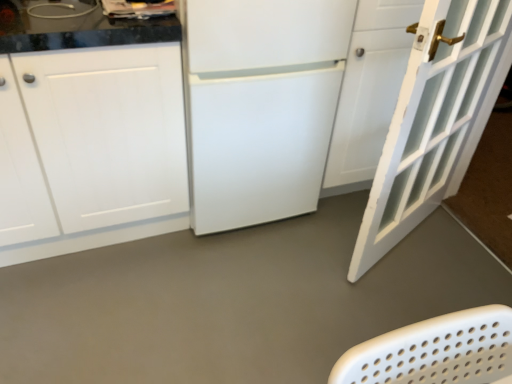
Question: Can you confirm if white matte cabinet at left is taller than white painted wood door at right?

Choices:
 (A) no
 (B) yes

Answer: (A)

Question: Is white matte cabinet at left directly adjacent to white painted wood door at right?

Choices:
 (A) yes
 (B) no

Answer: (B)

Question: Considering the relative sizes of white matte cabinet at left and white painted wood door at right in the image provided, is white matte cabinet at left bigger than white painted wood door at right?

Choices:
 (A) no
 (B) yes

Answer: (B)

Question: From a real-world perspective, is white matte cabinet at left located higher than white painted wood door at right?

Choices:
 (A) yes
 (B) no

Answer: (B)

Question: Is white matte cabinet at left oriented away from white painted wood door at right?

Choices:
 (A) yes
 (B) no

Answer: (B)

Question: Is white painted wood door at right bigger or smaller than white matte refrigerator at center?

Choices:
 (A) big
 (B) small

Answer: (B)

Question: Does point tap(457, 117) appear closer or farther from the camera than point tap(204, 168)?

Choices:
 (A) farther
 (B) closer

Answer: (A)

Question: Is white painted wood door at right inside the boundaries of white matte refrigerator at center, or outside?

Choices:
 (A) outside
 (B) inside

Answer: (A)

Question: In the image, is white painted wood door at right positioned in front of or behind white matte refrigerator at center?

Choices:
 (A) behind
 (B) front

Answer: (B)

Question: Is point (415, 319) positioned closer to the camera than point (439, 13)?

Choices:
 (A) farther
 (B) closer

Answer: (A)

Question: Is gray matte floor at center in front of or behind white painted wood door at right in the image?

Choices:
 (A) behind
 (B) front

Answer: (A)

Question: From the image's perspective, is gray matte floor at center above or below white painted wood door at right?

Choices:
 (A) above
 (B) below

Answer: (B)

Question: Is gray matte floor at center to the left or to the right of white painted wood door at right in the image?

Choices:
 (A) left
 (B) right

Answer: (A)

Question: Is white painted wood door at right spatially inside white matte cabinet at left, or outside of it?

Choices:
 (A) inside
 (B) outside

Answer: (B)

Question: In terms of size, does white painted wood door at right appear bigger or smaller than white matte cabinet at left?

Choices:
 (A) big
 (B) small

Answer: (B)